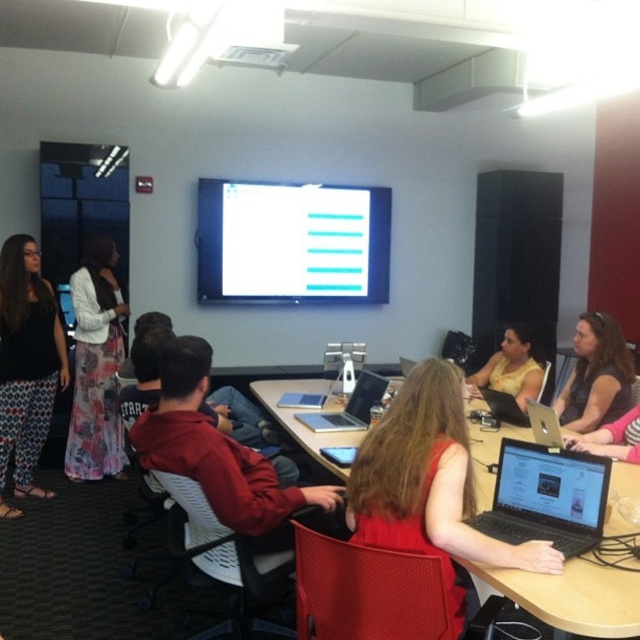
In the scene shown: Measure the distance from floral dress at left to satin black laptop at center.

floral dress at left and satin black laptop at center are 1.52 meters apart.

Who is positioned more to the left, floral dress at left or satin black laptop at center?

floral dress at left

Where is `floral dress at left`? Image resolution: width=640 pixels, height=640 pixels. floral dress at left is located at coordinates (97, 365).

In the scene shown: Who is positioned more to the left, red fabric jacket at center or yellow matte dress at center?

red fabric jacket at center

Can you confirm if red fabric jacket at center is positioned below yellow matte dress at center?

Yes.

Is point (150, 445) in front of point (512, 362)?

Yes, point (150, 445) is in front of point (512, 362).

You are a GUI agent. You are given a task and a screenshot of the screen. Output one action in this format:
    pyautogui.click(x=<x>, y=<y>)
    Task: Click on the red fabric jacket at center
    This screenshot has width=640, height=640.
    Given the screenshot: What is the action you would take?
    pyautogui.click(x=221, y=456)

Between white glossy projection screen at upper center and wooden table at center, which one is positioned higher?

white glossy projection screen at upper center

Which is below, white glossy projection screen at upper center or wooden table at center?

wooden table at center is lower down.

Who is more distant from viewer, (276,182) or (573,561)?

The point (276,182) is behind.

This screenshot has width=640, height=640. Find the location of `white glossy projection screen at upper center`. white glossy projection screen at upper center is located at coordinates (291, 243).